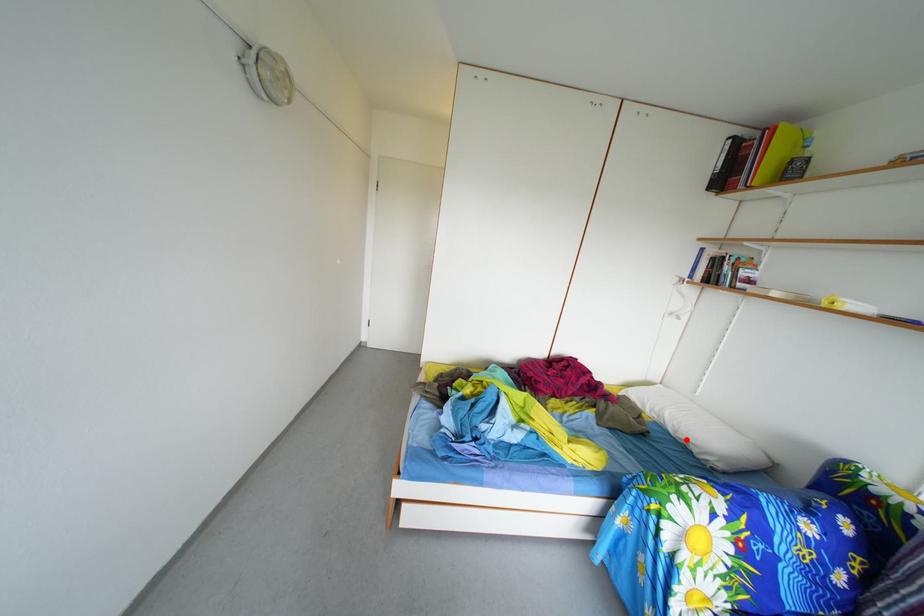
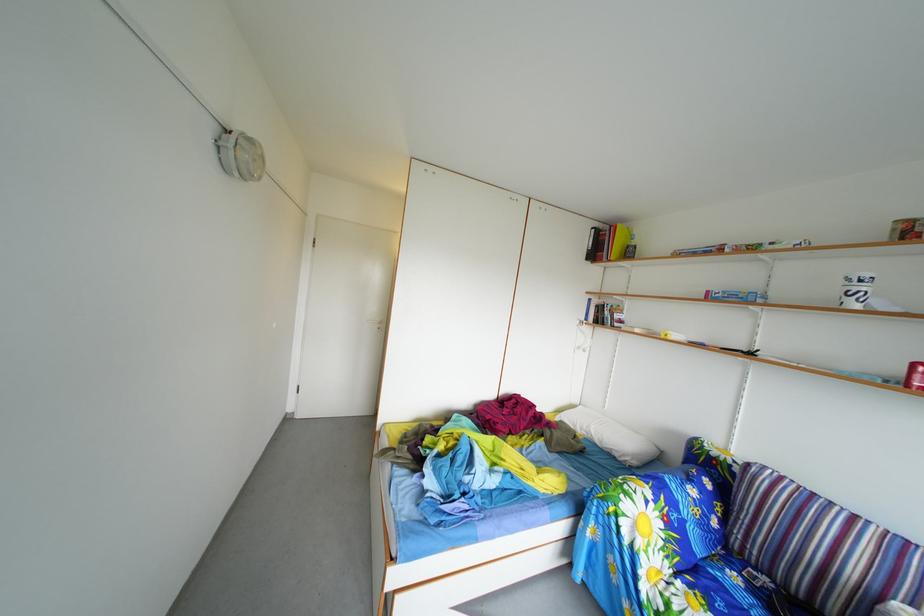
Question: I am providing you with two images of the same scene from different viewpoints. A red point is shown in image1. For the corresponding object point in image2, is it positioned nearer or farther from the camera?

Choices:
 (A) Nearer
 (B) Farther

Answer: (B)